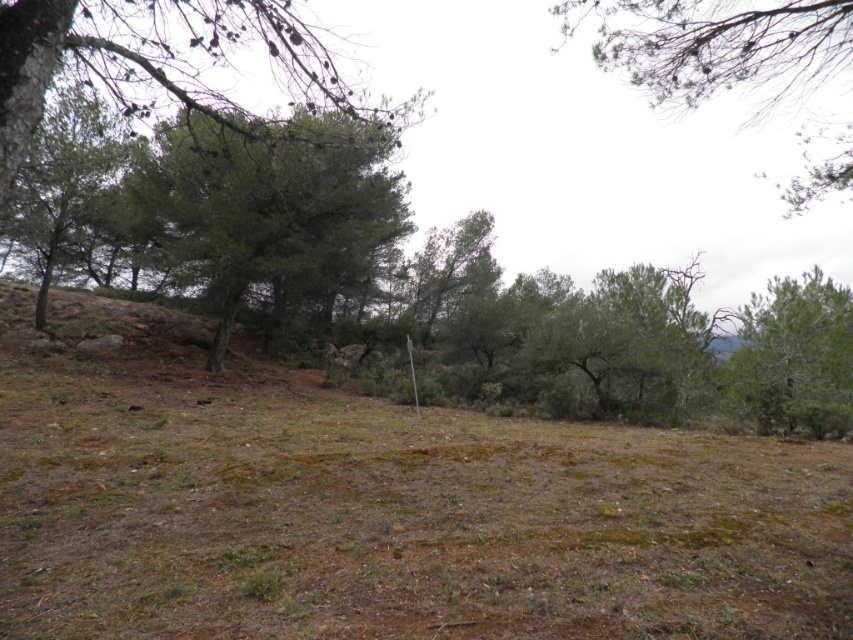
Question: Among these objects, which one is farthest from the camera?

Choices:
 (A) green textured tree at right
 (B) green leafy tree at upper center
 (C) green textured tree at center

Answer: (A)

Question: Considering the real-world distances, which object is closest to the green textured tree at right?

Choices:
 (A) green textured tree at center
 (B) green leafy tree at upper center

Answer: (B)

Question: Is green leafy tree at upper center further to the viewer compared to green textured tree at right?

Choices:
 (A) no
 (B) yes

Answer: (A)

Question: Observing the image, what is the correct spatial positioning of green leafy tree at upper center in reference to green textured tree at right?

Choices:
 (A) above
 (B) below

Answer: (A)

Question: Which of these objects is positioned closest to the green textured tree at center?

Choices:
 (A) green leafy tree at upper center
 (B) green textured tree at right

Answer: (A)

Question: Where is green textured tree at center located in relation to green leafy tree at upper center in the image?

Choices:
 (A) left
 (B) right

Answer: (A)